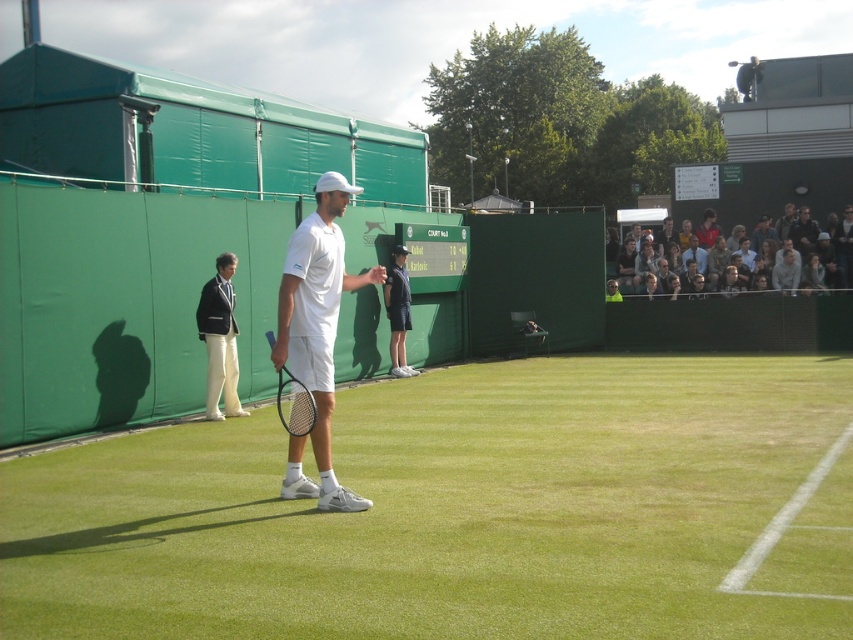
Question: Which point is farther to the camera?

Choices:
 (A) (671, 225)
 (B) (354, 602)

Answer: (A)

Question: Which object appears farthest from the camera in this image?

Choices:
 (A) green grass tennis court at center
 (B) white cotton shirt at center
 (C) white matte tennis racket at center

Answer: (B)

Question: Does white wool blazer at left have a greater width compared to dark blue shirt at upper right?

Choices:
 (A) yes
 (B) no

Answer: (B)

Question: Does light brown leather jacket at upper right appear over dark blue shirt at upper right?

Choices:
 (A) no
 (B) yes

Answer: (A)

Question: Does green grass tennis court at center appear over light brown leather jacket at upper right?

Choices:
 (A) no
 (B) yes

Answer: (A)

Question: Which object appears closest to the camera in this image?

Choices:
 (A) white matte tennis racket at center
 (B) dark blue shirt at upper right
 (C) black matte tennis racket at center
 (D) white wool blazer at left

Answer: (A)